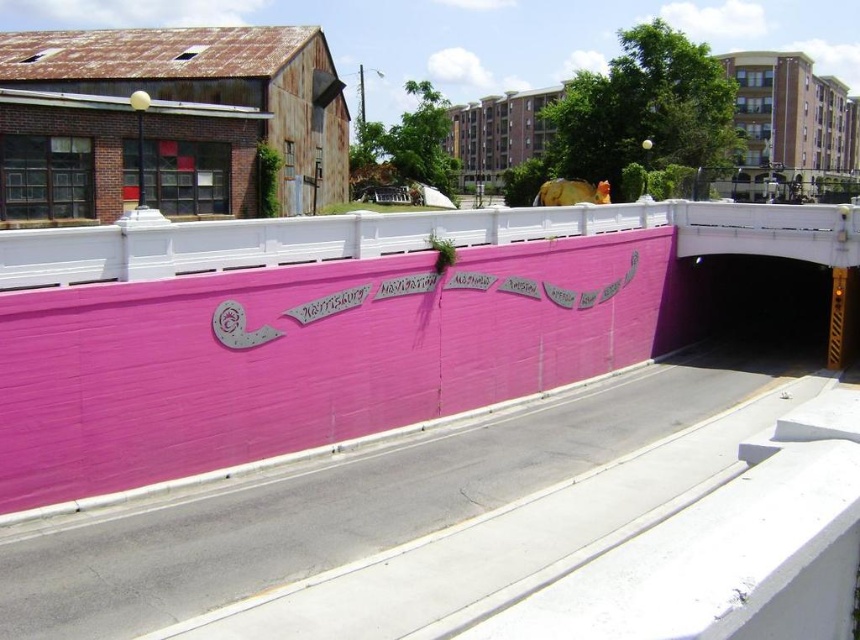
Looking at this image, does pink painted wall at center have a greater width compared to pink concrete highway at center?

Yes.

Can you confirm if pink painted wall at center is positioned below pink concrete highway at center?

No, pink painted wall at center is not below pink concrete highway at center.

At what (x,y) coordinates should I click in order to perform the action: click on pink painted wall at center. Please return your answer as a coordinate pair (x, y). The image size is (860, 640). Looking at the image, I should click on (329, 324).

The height and width of the screenshot is (640, 860). I want to click on pink painted wall at center, so click(329, 324).